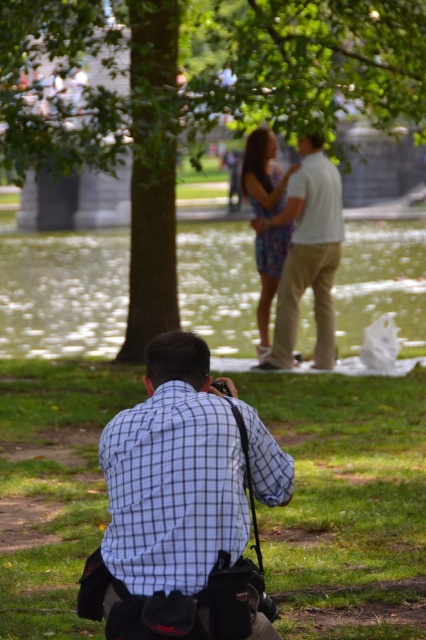
Question: Which of these objects is positioned closest to the blue checkered shirt at lower center?

Choices:
 (A) green grass at lower center
 (B) green leafy tree at upper center
 (C) white cotton pants at center
 (D) clear water at center

Answer: (A)

Question: Is clear water at center closer to the viewer compared to blue checkered shirt at lower center?

Choices:
 (A) no
 (B) yes

Answer: (A)

Question: Among these objects, which one is nearest to the camera?

Choices:
 (A) green leafy tree at upper center
 (B) blue checkered shirt at lower center
 (C) clear water at center
 (D) white cotton pants at center

Answer: (B)

Question: Is green grass at lower center positioned behind blue checkered shirt at lower center?

Choices:
 (A) yes
 (B) no

Answer: (A)

Question: Is clear water at center to the left of white cotton pants at center from the viewer's perspective?

Choices:
 (A) no
 (B) yes

Answer: (B)

Question: Which object is positioned closest to the white cotton pants at center?

Choices:
 (A) green grass at lower center
 (B) clear water at center

Answer: (B)